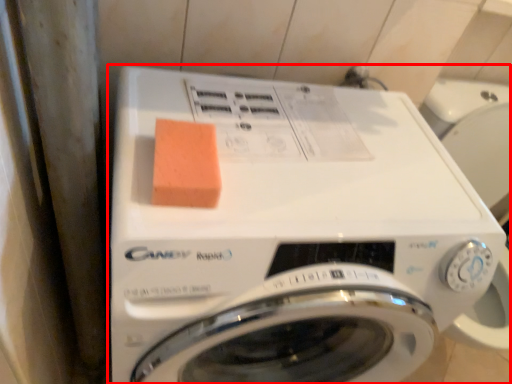
Question: From the image's perspective, what is the correct spatial positioning of washing machine (annotated by the red box) in reference to food?

Choices:
 (A) below
 (B) above

Answer: (A)